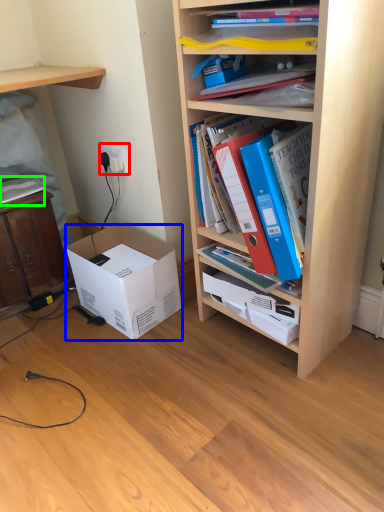
Question: Which is farther away from electric outlet (highlighted by a red box)? box (highlighted by a blue box) or book (highlighted by a green box)?

Choices:
 (A) box
 (B) book

Answer: (A)